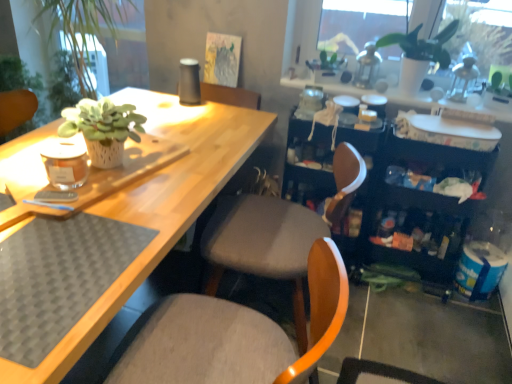
Question: Is black plastic bookshelf at right not within matte gray cushioned chair at center, the 2th chair in the back-to-front sequence?

Choices:
 (A) yes
 (B) no

Answer: (A)

Question: Can you confirm if black plastic bookshelf at right is positioned to the left of matte gray cushioned chair at center, the 2th chair in the back-to-front sequence?

Choices:
 (A) no
 (B) yes

Answer: (A)

Question: Can you confirm if black plastic bookshelf at right is positioned to the right of matte gray cushioned chair at center, the 1th chair positioned from the front?

Choices:
 (A) no
 (B) yes

Answer: (B)

Question: Is black plastic bookshelf at right positioned with its back to matte gray cushioned chair at center, the 2th chair in the back-to-front sequence?

Choices:
 (A) no
 (B) yes

Answer: (A)

Question: From a real-world perspective, is black plastic bookshelf at right beneath matte gray cushioned chair at center, the 1th chair positioned from the front?

Choices:
 (A) no
 (B) yes

Answer: (B)

Question: From a real-world perspective, is black plastic bookshelf at right over matte gray cushioned chair at center, the 2th chair in the back-to-front sequence?

Choices:
 (A) yes
 (B) no

Answer: (B)

Question: Is fabric cushioned chair at center, the first chair in the back-to-front sequence, touching matte gray cushioned chair at center, the 1th chair positioned from the front?

Choices:
 (A) yes
 (B) no

Answer: (B)

Question: Does fabric cushioned chair at center, the first chair in the back-to-front sequence, come in front of matte gray cushioned chair at center, the 2th chair in the back-to-front sequence?

Choices:
 (A) no
 (B) yes

Answer: (A)

Question: From the image's perspective, would you say fabric cushioned chair at center, the first chair in the back-to-front sequence, is shown under matte gray cushioned chair at center, the 2th chair in the back-to-front sequence?

Choices:
 (A) no
 (B) yes

Answer: (A)

Question: Is fabric cushioned chair at center, which appears as the 2th chair when viewed from the front, oriented away from matte gray cushioned chair at center, the 2th chair in the back-to-front sequence?

Choices:
 (A) yes
 (B) no

Answer: (B)

Question: Is fabric cushioned chair at center, the first chair in the back-to-front sequence, further to the viewer compared to matte gray cushioned chair at center, the 1th chair positioned from the front?

Choices:
 (A) yes
 (B) no

Answer: (A)

Question: From a real-world perspective, is fabric cushioned chair at center, the first chair in the back-to-front sequence, on top of matte gray cushioned chair at center, the 2th chair in the back-to-front sequence?

Choices:
 (A) no
 (B) yes

Answer: (B)

Question: From the image's perspective, is white matte plant pot at upper right on top of black plastic bookshelf at right?

Choices:
 (A) yes
 (B) no

Answer: (A)